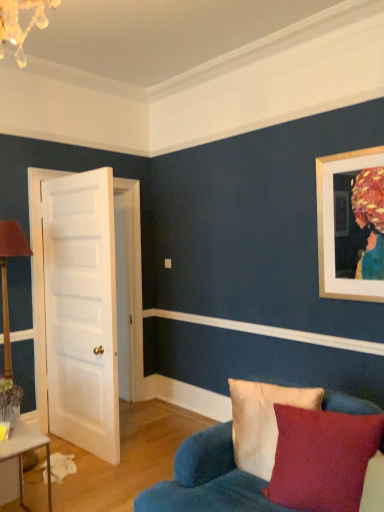
Question: From the image's perspective, is velvety red pillow at lower right, the 2th pillow when ordered from back to front, located above or below white glossy table at lower left?

Choices:
 (A) above
 (B) below

Answer: (A)

Question: Is point (301, 494) positioned closer to the camera than point (18, 456)?

Choices:
 (A) farther
 (B) closer

Answer: (B)

Question: Estimate the real-world distances between objects in this image. Which object is farther from the velvet blue couch at lower right?

Choices:
 (A) white glossy table at lower left
 (B) velvety red pillow at lower right, the first pillow in the front-to-back sequence
 (C) velvet beige pillow at lower right, the 2th pillow in the front-to-back sequence
 (D) white smooth molding at center
 (E) white smooth door at left

Answer: (E)

Question: Which of these objects is positioned farthest from the white smooth door at left?

Choices:
 (A) velvety red pillow at lower right, the 2th pillow when ordered from back to front
 (B) velvet blue couch at lower right
 (C) white glossy table at lower left
 (D) velvet beige pillow at lower right, the 2th pillow in the front-to-back sequence
 (E) white smooth molding at center

Answer: (A)